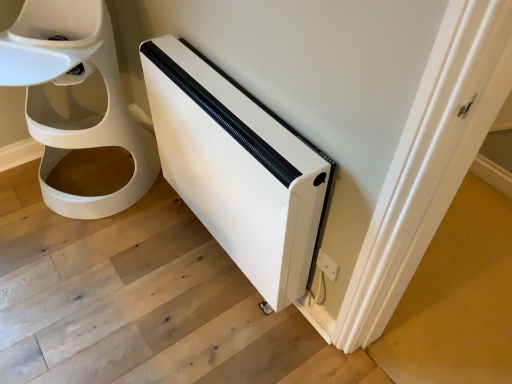
Question: From the image's perspective, is white matte heater at lower right above white matte heater at lower right?

Choices:
 (A) yes
 (B) no

Answer: (B)

Question: Is white matte heater at lower right to the right of white matte heater at lower right from the viewer's perspective?

Choices:
 (A) yes
 (B) no

Answer: (A)

Question: Is white matte heater at lower right far from white matte heater at lower right?

Choices:
 (A) yes
 (B) no

Answer: (B)

Question: Would you say white matte heater at lower right contains white matte heater at lower right?

Choices:
 (A) no
 (B) yes

Answer: (A)

Question: Is white matte heater at lower right oriented towards white matte heater at lower right?

Choices:
 (A) yes
 (B) no

Answer: (B)

Question: Considering the relative positions of white matte heater at lower right and white plastic electric outlet at lower right in the image provided, is white matte heater at lower right to the left or to the right of white plastic electric outlet at lower right?

Choices:
 (A) right
 (B) left

Answer: (B)

Question: Is white matte heater at lower right wider or thinner than white plastic electric outlet at lower right?

Choices:
 (A) thin
 (B) wide

Answer: (B)

Question: Considering the positions of point (x=155, y=144) and point (x=331, y=266), is point (x=155, y=144) closer or farther from the camera than point (x=331, y=266)?

Choices:
 (A) closer
 (B) farther

Answer: (B)

Question: Based on their sizes in the image, would you say white matte heater at lower right is bigger or smaller than white plastic electric outlet at lower right?

Choices:
 (A) small
 (B) big

Answer: (B)

Question: From the image's perspective, is white matte heater at lower right above or below white matte heater at lower right?

Choices:
 (A) below
 (B) above

Answer: (B)

Question: Is white matte heater at lower right wider or thinner than white matte heater at lower right?

Choices:
 (A) wide
 (B) thin

Answer: (A)

Question: Do you think white matte heater at lower right is within white matte heater at lower right, or outside of it?

Choices:
 (A) inside
 (B) outside

Answer: (B)

Question: From a real-world perspective, is white matte heater at lower right above or below white matte heater at lower right?

Choices:
 (A) below
 (B) above

Answer: (B)

Question: In terms of width, does white plastic electric outlet at lower right look wider or thinner when compared to white matte heater at lower right?

Choices:
 (A) thin
 (B) wide

Answer: (A)

Question: Choose the correct answer: Is white plastic electric outlet at lower right inside white matte heater at lower right or outside it?

Choices:
 (A) outside
 (B) inside

Answer: (A)